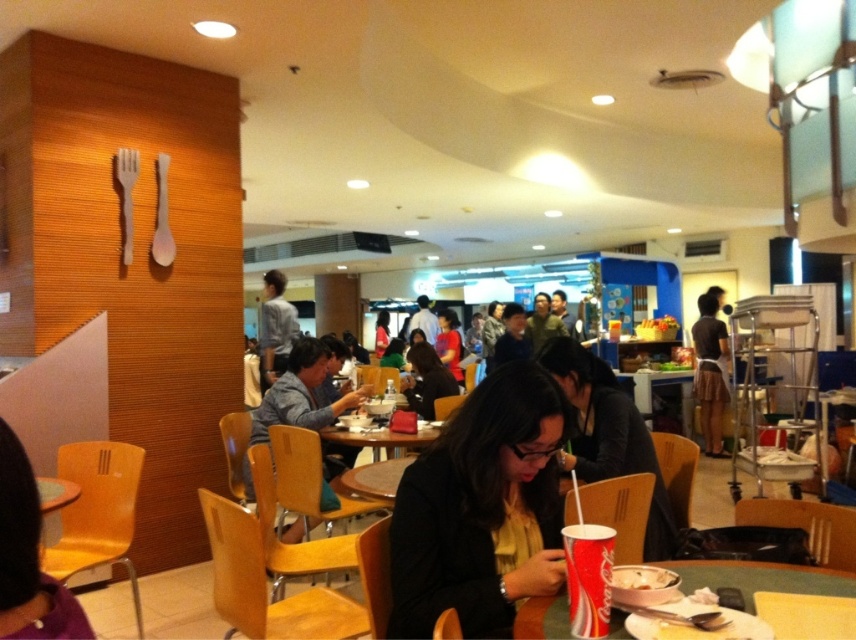
Question: Considering the relative positions of matte plastic table at center and matte black hair at center in the image provided, where is matte plastic table at center located with respect to matte black hair at center?

Choices:
 (A) right
 (B) left

Answer: (A)

Question: Which object is the closest to the matte black hair at center?

Choices:
 (A) matte black jacket at center
 (B) wooden table at center
 (C) white paper cup at center
 (D) matte red cup at lower center

Answer: (B)

Question: Which of these objects is positioned farthest from the matte red cup at lower center?

Choices:
 (A) white paper cup at center
 (B) wooden table at center

Answer: (B)

Question: Does matte red cup at lower center appear under white paper cup at center?

Choices:
 (A) yes
 (B) no

Answer: (B)

Question: Estimate the real-world distances between objects in this image. Which object is farther from the matte plastic table at center?

Choices:
 (A) matte black jacket at center
 (B) wooden table at center

Answer: (B)

Question: Does matte red cup at lower center appear on the left side of white paper cup at center?

Choices:
 (A) yes
 (B) no

Answer: (A)